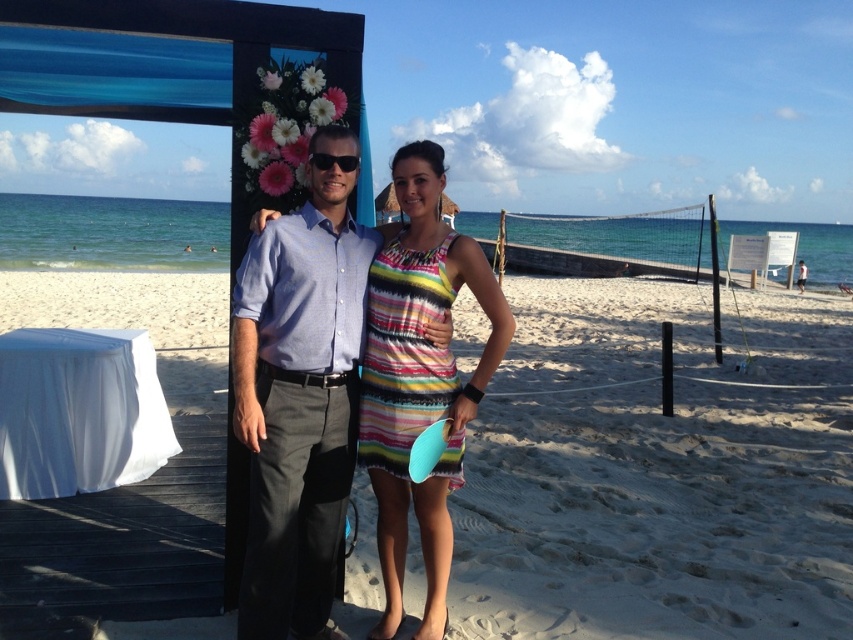
Question: Can you confirm if light blue shirt at center is smaller than striped fabric dress at center?

Choices:
 (A) no
 (B) yes

Answer: (B)

Question: Considering the relative positions of light blue shirt at center and striped fabric dress at center in the image provided, where is light blue shirt at center located with respect to striped fabric dress at center?

Choices:
 (A) right
 (B) left

Answer: (B)

Question: Which point appears closest to the camera in this image?

Choices:
 (A) (686, 560)
 (B) (398, 268)

Answer: (B)

Question: Which of the following is the closest to the observer?

Choices:
 (A) click(691, 292)
 (B) click(383, 544)

Answer: (B)

Question: Which is nearer to the light blue shirt at center?

Choices:
 (A) white sand at center
 (B) striped fabric dress at center

Answer: (B)

Question: Can you confirm if light blue shirt at center is positioned below striped fabric dress at center?

Choices:
 (A) yes
 (B) no

Answer: (A)